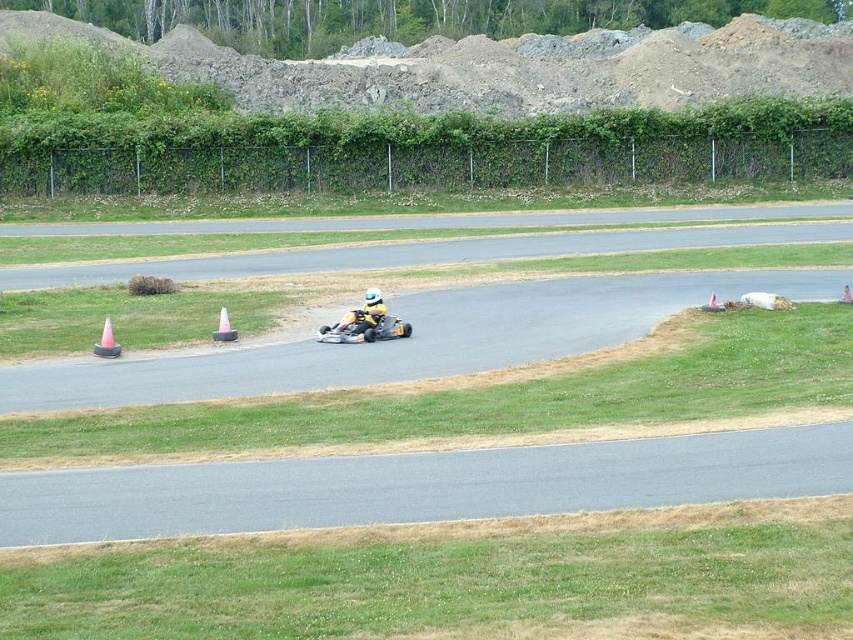
Question: Is yellow matte go-kart at center wider than orange plastic traffic cone at center?

Choices:
 (A) yes
 (B) no

Answer: (A)

Question: Which object appears closest to the camera in this image?

Choices:
 (A) pink plastic traffic cone at left
 (B) yellow matte go-kart at center
 (C) orange plastic traffic cone at center

Answer: (A)

Question: Which point is farther to the camera?

Choices:
 (A) (224, 324)
 (B) (106, 353)

Answer: (A)

Question: Where is yellow matte go-kart at center located in relation to orange plastic traffic cone at center in the image?

Choices:
 (A) left
 (B) right

Answer: (B)

Question: Which object is positioned farthest from the orange plastic traffic cone at center?

Choices:
 (A) yellow matte go-kart at center
 (B) pink plastic traffic cone at left

Answer: (B)

Question: Is yellow matte go-kart at center thinner than orange plastic traffic cone at center?

Choices:
 (A) no
 (B) yes

Answer: (A)